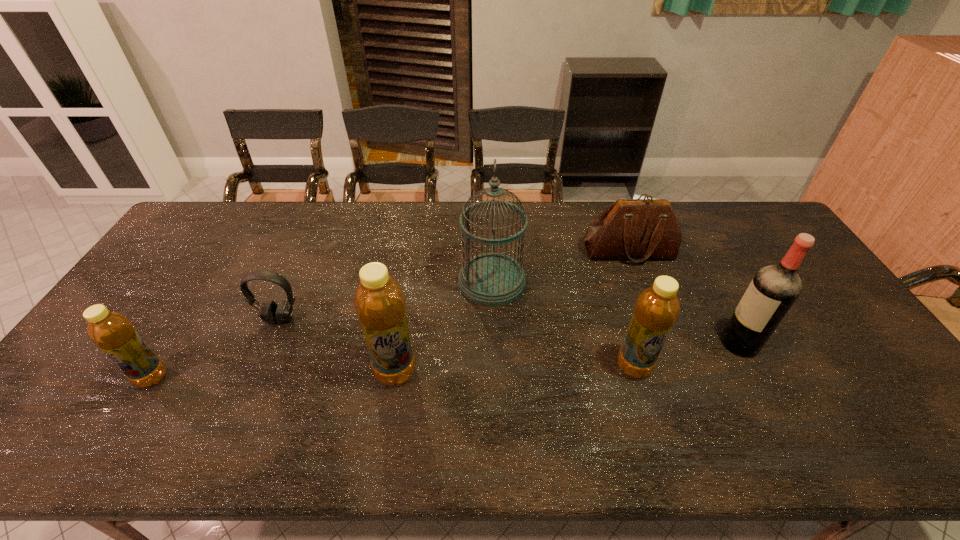
Identify the location of unoccupied position between the rightmost bottle and the fourth object from right to left. (563, 324).

Where is `vacant area between the second bottle from right to left and the liquor`? This screenshot has width=960, height=540. vacant area between the second bottle from right to left and the liquor is located at coordinates (567, 357).

Where is `free space between the second bottle from left to right and the second tallest bottle`? The image size is (960, 540). free space between the second bottle from left to right and the second tallest bottle is located at coordinates (515, 369).

The width and height of the screenshot is (960, 540). I want to click on free point between the rightmost bottle and the headset, so click(x=457, y=342).

Where is `vacant space that is in between the rightmost bottle and the shoulder bag`? Image resolution: width=960 pixels, height=540 pixels. vacant space that is in between the rightmost bottle and the shoulder bag is located at coordinates (632, 309).

Find the location of a particular element. free spot between the shortest bottle and the birdcage is located at coordinates (322, 329).

Locate an element on the screen. free space between the liquor and the headset is located at coordinates (510, 331).

Locate an element on the screen. The image size is (960, 540). empty space that is in between the third object from left to right and the second shortest bottle is located at coordinates (515, 369).

Locate which object ranks fourth in proximity to the second object from left to right. Please provide its 2D coordinates. Your answer should be formatted as a tuple, i.e. [(x, y)], where the tuple contains the x and y coordinates of a point satisfying the conditions above.

[(656, 310)]

Identify which object is located as the sixth nearest to the shoulder bag. Please provide its 2D coordinates. Your answer should be formatted as a tuple, i.e. [(x, y)], where the tuple contains the x and y coordinates of a point satisfying the conditions above.

[(112, 332)]